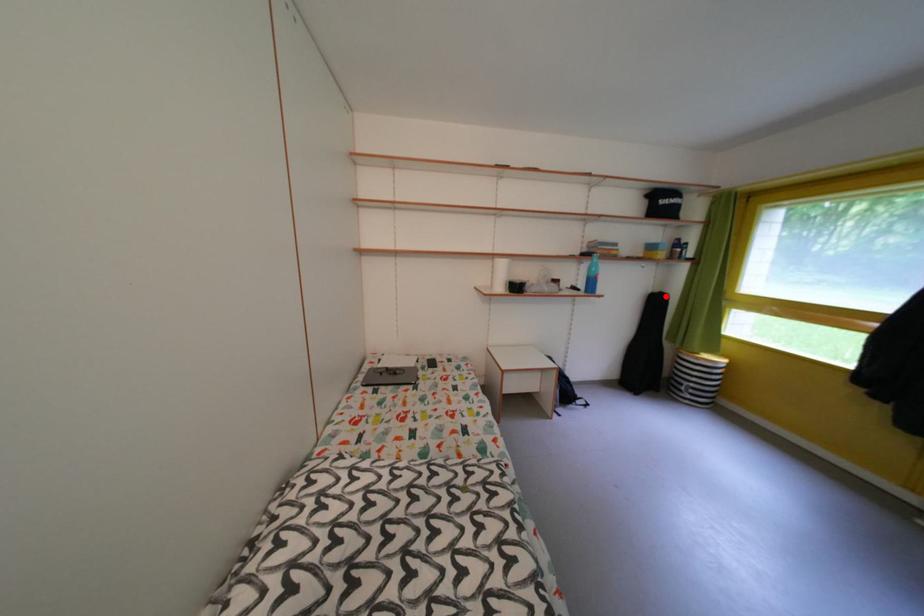
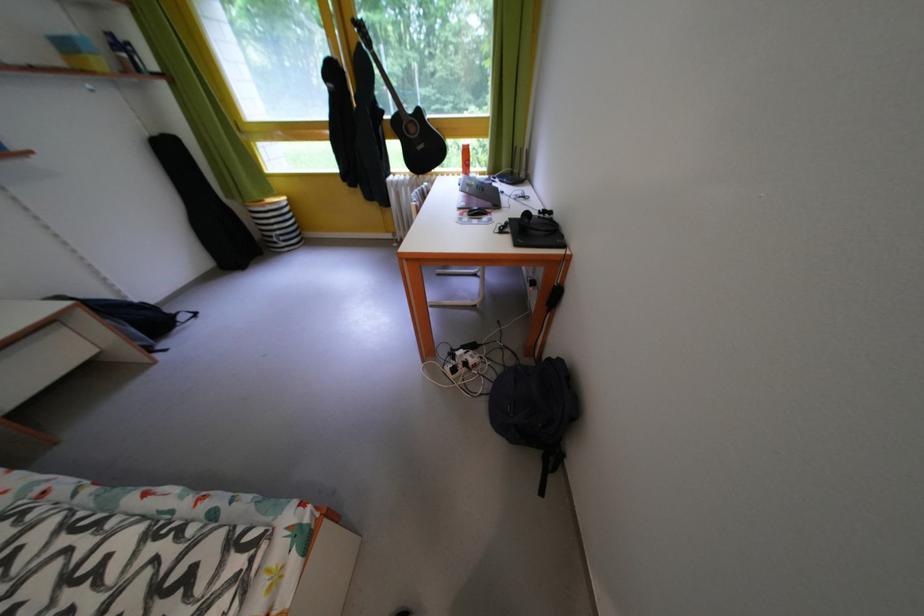
In the second image, find the point that corresponds to the highlighted location in the first image.

(165, 139)